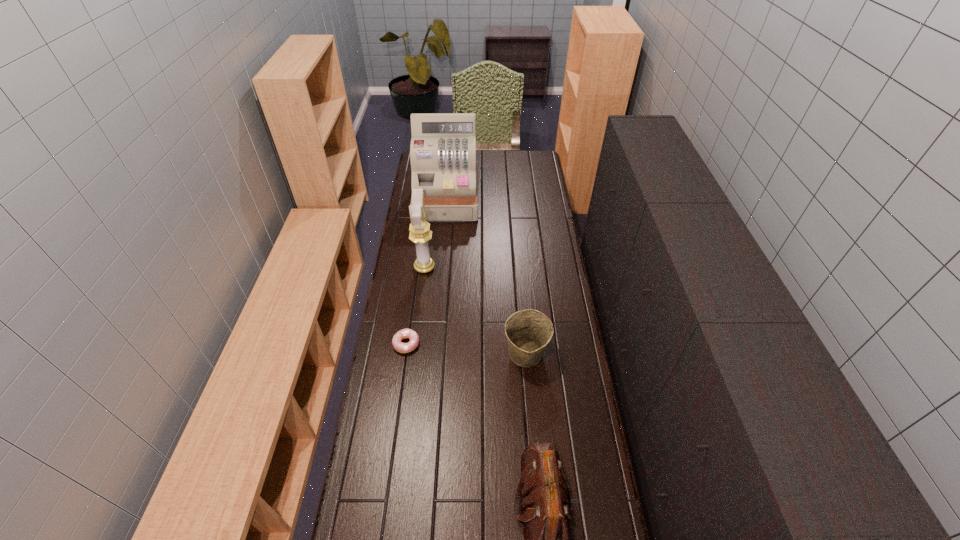
This screenshot has height=540, width=960. Identify the location of the farthest object. (443, 146).

Find the location of a particular element. Image resolution: width=960 pixels, height=540 pixels. award is located at coordinates (420, 233).

Locate an element on the screen. This screenshot has width=960, height=540. wine bucket is located at coordinates (529, 331).

You are a GUI agent. You are given a task and a screenshot of the screen. Output one action in this format:
    pyautogui.click(x=<x>, y=<y>)
    Task: Click on the doughnut
    This screenshot has height=540, width=960.
    Given the screenshot: What is the action you would take?
    pyautogui.click(x=399, y=346)

I want to click on vacant space located 0.310m on the operating side of the cash register, so click(441, 267).

The image size is (960, 540). Find the location of `blank space located 0.390m on the front-facing side of the second farthest object`. blank space located 0.390m on the front-facing side of the second farthest object is located at coordinates (521, 267).

At what (x,y) coordinates should I click in order to perform the action: click on vacant position located on the back of the wine bucket. Please return your answer as a coordinate pair (x, y). The height and width of the screenshot is (540, 960). Looking at the image, I should click on (520, 292).

Where is `vacant space located on the back of the doughnut`? The width and height of the screenshot is (960, 540). vacant space located on the back of the doughnut is located at coordinates (416, 280).

Locate an element on the screen. This screenshot has width=960, height=540. cash register that is at the left edge is located at coordinates [x=443, y=146].

Locate an element on the screen. The width and height of the screenshot is (960, 540). award that is at the left edge is located at coordinates (420, 233).